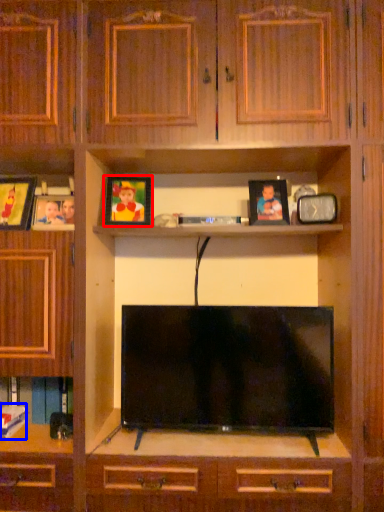
Question: Which object is closer to the camera taking this photo, picture frame (highlighted by a red box) or book (highlighted by a blue box)?

Choices:
 (A) picture frame
 (B) book

Answer: (B)